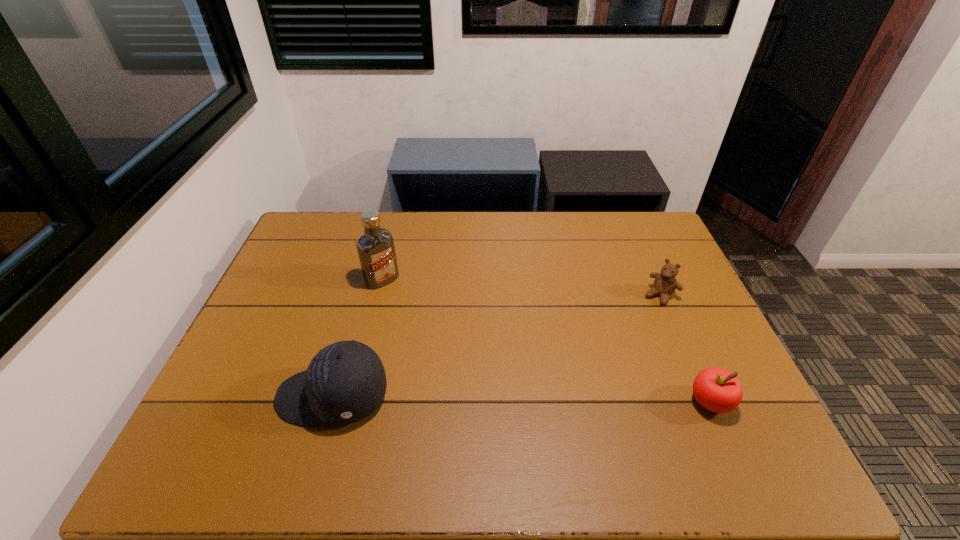
I want to click on the second tallest object, so click(x=345, y=382).

This screenshot has height=540, width=960. I want to click on apple, so pos(716,389).

Locate an element on the screen. The image size is (960, 540). the tallest object is located at coordinates (376, 250).

Image resolution: width=960 pixels, height=540 pixels. Find the location of `teddy bear`. teddy bear is located at coordinates click(665, 283).

In order to click on vacant space located 0.160m at the front of the third shortest object where the brim is located in this screenshot , I will do [x=212, y=396].

The width and height of the screenshot is (960, 540). In order to click on vacant space situated 0.060m at the front of the third shortest object where the brim is located in this screenshot , I will do `click(253, 396)`.

Identify the location of free space located 0.140m at the front of the third shortest object where the brim is located. (221, 396).

You are a GUI agent. You are given a task and a screenshot of the screen. Output one action in this format:
    pyautogui.click(x=<x>, y=<y>)
    Task: Click on the vacant space located on the left of the apple
    This screenshot has height=540, width=960.
    Given the screenshot: What is the action you would take?
    pyautogui.click(x=577, y=402)

Locate an element on the screen. This screenshot has height=540, width=960. vacant region located 0.320m on the front-facing side of the vodka is located at coordinates (453, 350).

Image resolution: width=960 pixels, height=540 pixels. I want to click on free spot located 0.400m on the front-facing side of the vodka, so click(x=471, y=369).